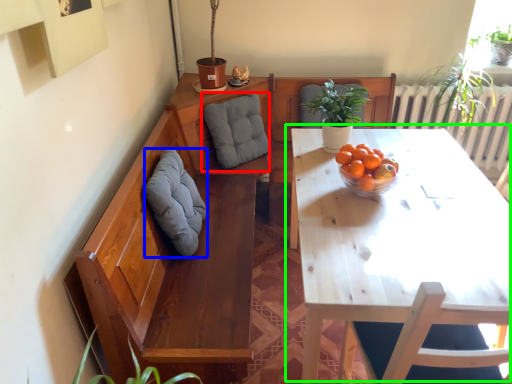
Question: Estimate the real-world distances between objects in this image. Which object is farther from gray (highlighted by a red box), gray (highlighted by a blue box) or table (highlighted by a green box)?

Choices:
 (A) gray
 (B) table

Answer: (B)